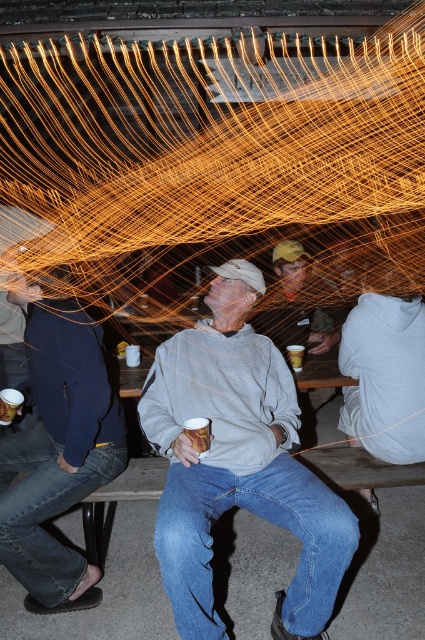
Question: Is gray cotton sweatshirt at center wider than brown paper cup at center?

Choices:
 (A) no
 (B) yes

Answer: (B)

Question: Which object appears farthest from the camera in this image?

Choices:
 (A) gray cotton sweatshirt at center
 (B) brown paper cup at center

Answer: (B)

Question: Which of the following is the closest to the observer?

Choices:
 (A) (303, 346)
 (B) (53, 483)
 (C) (217, 460)

Answer: (B)

Question: Is gray cotton sweatshirt at center bigger than brown paper cup at center?

Choices:
 (A) yes
 (B) no

Answer: (A)

Question: Estimate the real-world distances between objects in this image. Which object is farther from the dark blue fleece jacket at left?

Choices:
 (A) gray cotton sweatshirt at center
 (B) white glossy mug at center
 (C) light gray sweatshirt at center
 (D) brown paper cup at center

Answer: (A)

Question: Where is light gray sweatshirt at center located in relation to dark blue fleece jacket at left in the image?

Choices:
 (A) right
 (B) left

Answer: (A)